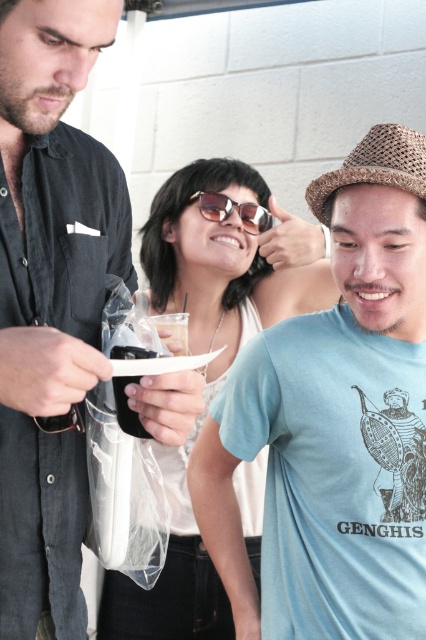
Question: Considering the real-world distances, which object is closest to the matte black phone at center?

Choices:
 (A) blue cotton t-shirt at center
 (B) white matte sunglasses at center

Answer: (A)

Question: Is matte black phone at center to the right of sunglasses at center from the viewer's perspective?

Choices:
 (A) no
 (B) yes

Answer: (A)

Question: Considering the real-world distances, which object is closest to the white matte sunglasses at center?

Choices:
 (A) sunglasses at center
 (B) matte black phone at center

Answer: (A)

Question: Among these points, which one is farthest from the camera?

Choices:
 (A) (8, 477)
 (B) (163, 250)
 (C) (422, 381)

Answer: (B)

Question: Is blue cotton t-shirt at center smaller than matte black phone at center?

Choices:
 (A) yes
 (B) no

Answer: (B)

Question: Is matte black phone at center closer to camera compared to white matte sunglasses at center?

Choices:
 (A) yes
 (B) no

Answer: (A)